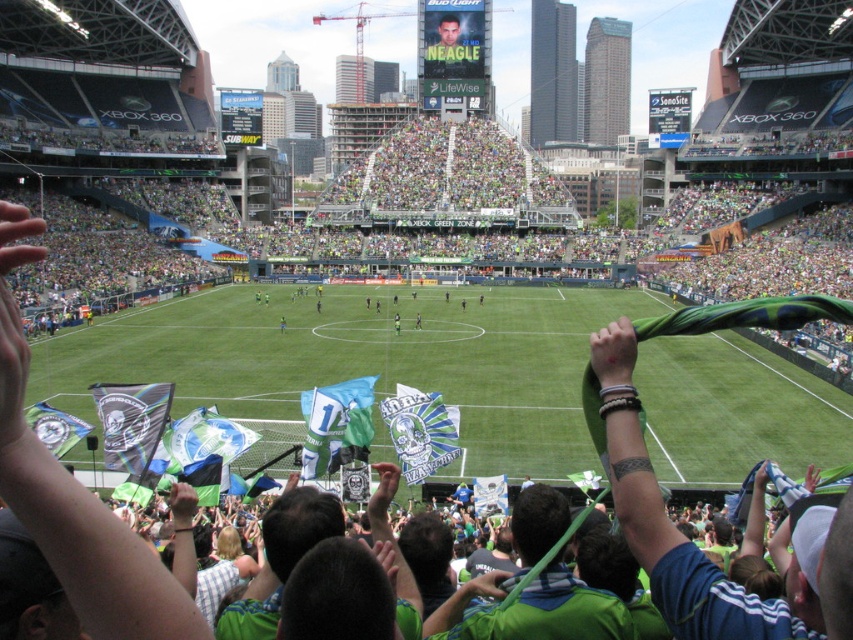
Is green grass at center to the left of green fabric banner at center from the viewer's perspective?

Indeed, green grass at center is positioned on the left side of green fabric banner at center.

Describe the element at coordinates (361, 362) in the screenshot. The width and height of the screenshot is (853, 640). I see `green grass at center` at that location.

This screenshot has width=853, height=640. I want to click on green grass at center, so pyautogui.click(x=361, y=362).

Is green grass at center smaller than black matte flag at center?

Actually, green grass at center might be larger than black matte flag at center.

Who is shorter, green grass at center or black matte flag at center?

black matte flag at center is shorter.

Is point (439, 314) more distant than point (158, 413)?

Yes, point (439, 314) is farther from viewer.

Where is `green grass at center`? green grass at center is located at coordinates (361, 362).

Is point (390, 406) positioned in front of point (393, 323)?

Yes, it is.

Does green fabric banner at center appear on the right side of green jersey at center?

Indeed, green fabric banner at center is positioned on the right side of green jersey at center.

Is point (428, 412) farther from camera compared to point (398, 332)?

That is False.

This screenshot has width=853, height=640. Find the location of `green fabric banner at center`. green fabric banner at center is located at coordinates (421, 432).